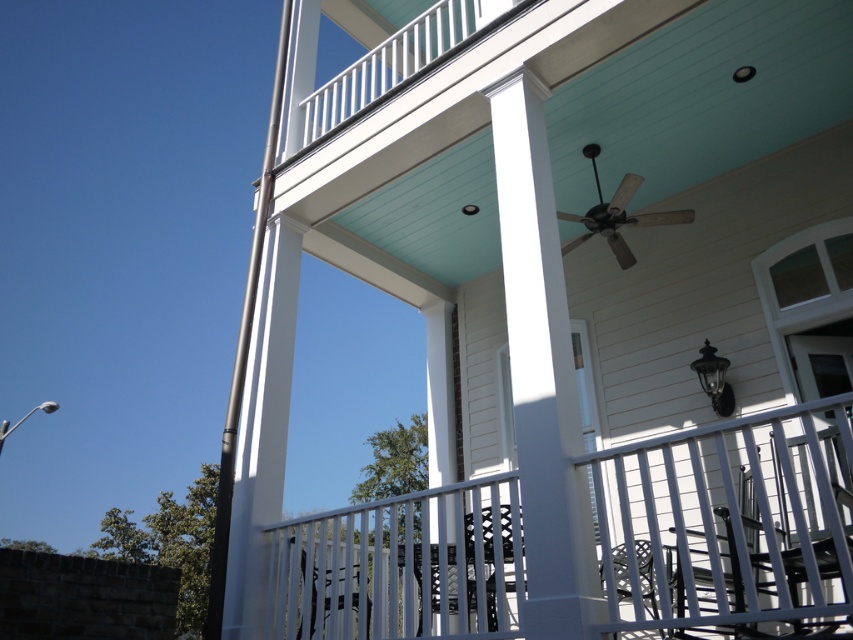
You are standing on the porch and want to hang a decoration between the two points, point (608,621) and point (532,308). Which point is closer to you so you can reach it easily?

Point (608,621) is closer to the camera than point (532,308), so you can reach it more easily.

You are a painter who needs to paint the white metal railing at lower center and the white smooth column at center. You have a ladder that is 1.5 meters long. Can you safely reach both objects from the ladder without moving it?

The white metal railing at lower center is 1.38 meters from the white smooth column at center. Since the ladder is 1.5 meters long, it can reach both objects as the distance between them is less than the ladder length.